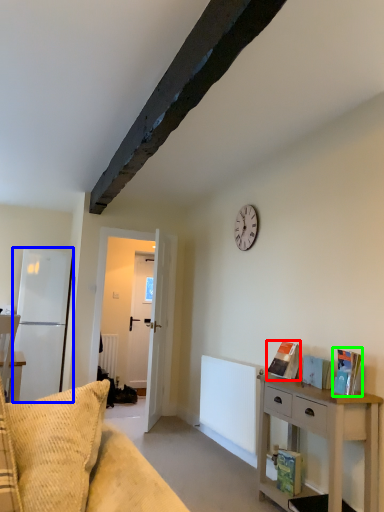
Question: Based on their relative distances, which object is nearer to book (highlighted by a red box)? Choose from fridge (highlighted by a blue box) and book (highlighted by a green box).

Choices:
 (A) fridge
 (B) book

Answer: (B)